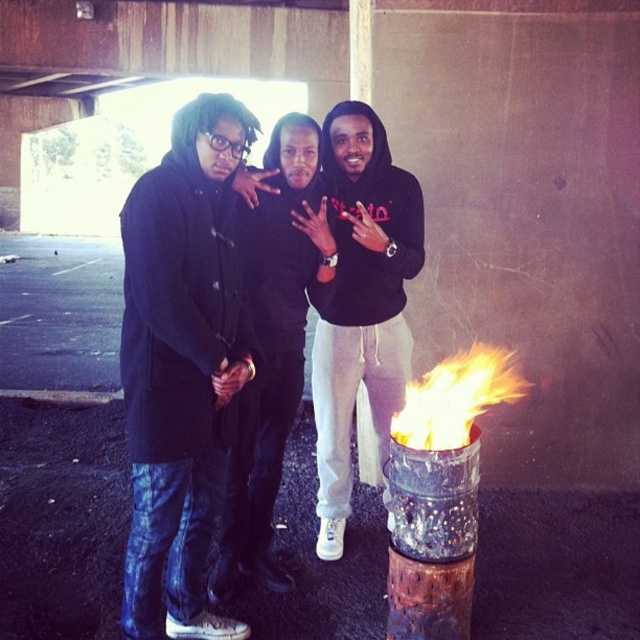
Which of these two, denim jacket at left or black hoodie at center, stands taller?

black hoodie at center

Who is positioned more to the left, denim jacket at left or black hoodie at center?

Positioned to the left is denim jacket at left.

Is point (134, 236) behind point (326, 138)?

No, it is in front of (326, 138).

The height and width of the screenshot is (640, 640). Find the location of `denim jacket at left`. denim jacket at left is located at coordinates (180, 364).

Is point (346, 237) closer to viewer compared to point (416, 435)?

No.

Does point (380, 408) lie behind point (472, 380)?

Yes, point (380, 408) is behind point (472, 380).

You are a GUI agent. You are given a task and a screenshot of the screen. Output one action in this format:
    pyautogui.click(x=<x>, y=<y>)
    Task: Click on the black hoodie at center
    
    Given the screenshot: What is the action you would take?
    pyautogui.click(x=362, y=301)

The width and height of the screenshot is (640, 640). I want to click on black hoodie at center, so click(362, 301).

Is denim jacket at left behind flamefluffyfire at lower center?

No, it is not.

Between denim jacket at left and flamefluffyfire at lower center, which one appears on the left side from the viewer's perspective?

Positioned to the left is denim jacket at left.

Which is behind, point (177, 388) or point (444, 392)?

The point (444, 392) is behind.

Image resolution: width=640 pixels, height=640 pixels. In order to click on denim jacket at left in this screenshot , I will do [180, 364].